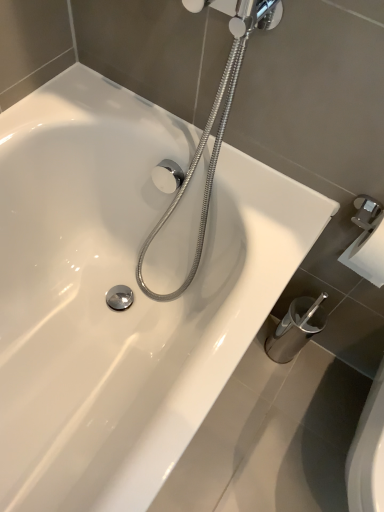
Where is `chrome/metallic showerhead at center`? chrome/metallic showerhead at center is located at coordinates (219, 125).

Describe the element at coordinates (219, 125) in the screenshot. I see `chrome/metallic showerhead at center` at that location.

The width and height of the screenshot is (384, 512). In order to click on chrome/metallic showerhead at center in this screenshot , I will do `click(219, 125)`.